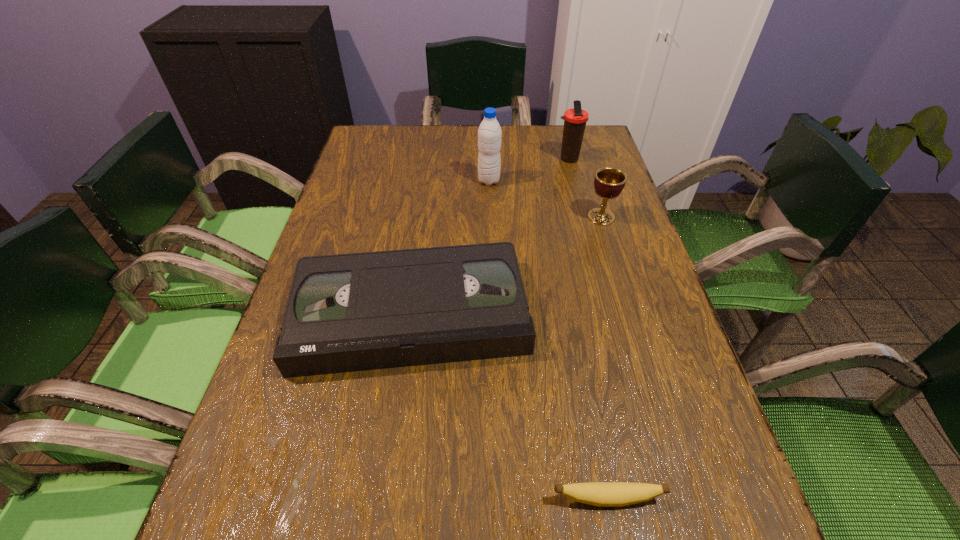
I want to click on free point between the shortest object and the fourth tallest object, so click(x=509, y=406).

Where is `vacant space that is in between the fourth shortest object and the videotape`? This screenshot has width=960, height=540. vacant space that is in between the fourth shortest object and the videotape is located at coordinates (490, 237).

What are the coordinates of `free spot between the shortest object and the third shortest object` in the screenshot? It's located at (604, 357).

This screenshot has width=960, height=540. What are the coordinates of `free point between the nearest object and the fourth nearest object` in the screenshot? It's located at (548, 340).

Identify which object is located as the third nearest to the tallest object. Please provide its 2D coordinates. Your answer should be formatted as a tuple, i.e. [(x, y)], where the tuple contains the x and y coordinates of a point satisfying the conditions above.

[(350, 312)]

Identify which object is located as the third nearest to the thermos bottle. Please provide its 2D coordinates. Your answer should be formatted as a tuple, i.e. [(x, y)], where the tuple contains the x and y coordinates of a point satisfying the conditions above.

[(350, 312)]

Find the location of `free space that satisfies the following two spatial constraints: 1. on the front side of the fourth tallest object; 2. on the left side of the nearest object`. free space that satisfies the following two spatial constraints: 1. on the front side of the fourth tallest object; 2. on the left side of the nearest object is located at coordinates (386, 498).

This screenshot has height=540, width=960. What are the coordinates of `free space in the image that satisfies the following two spatial constraints: 1. on the front side of the water bottle; 2. on the right side of the chalice` in the screenshot? It's located at (490, 217).